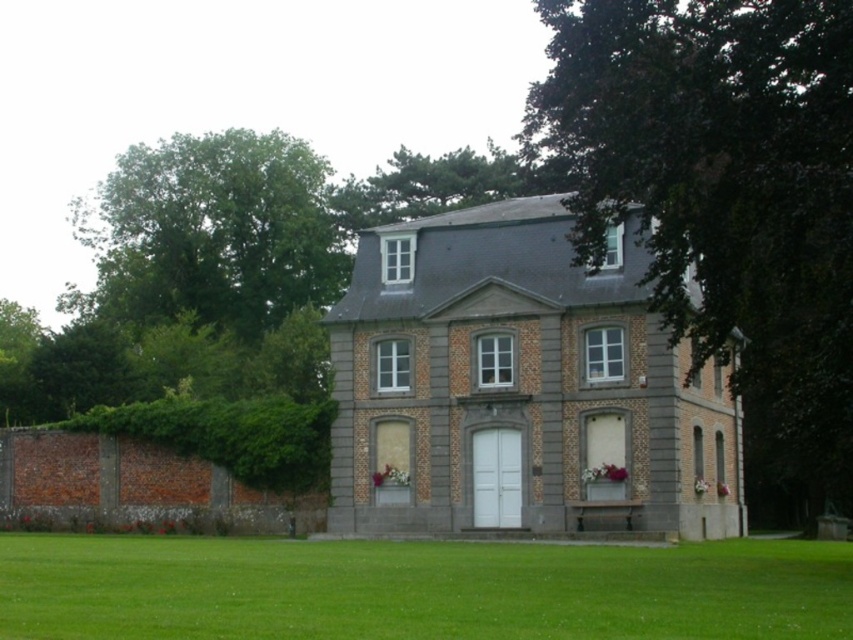
Question: Can you confirm if dark green leafy tree at right is positioned above green leafy tree at upper left?

Choices:
 (A) yes
 (B) no

Answer: (B)

Question: Which object is closer to the camera taking this photo?

Choices:
 (A) dark green leafy tree at right
 (B) green grass at lower center
 (C) green leafy hedge at left

Answer: (B)

Question: Does green leafy tree at upper left have a greater width compared to green leafy hedge at left?

Choices:
 (A) yes
 (B) no

Answer: (A)

Question: Among these points, which one is farthest from the camera?

Choices:
 (A) coord(595,13)
 (B) coord(711,605)

Answer: (A)

Question: Which object is farther from the camera taking this photo?

Choices:
 (A) green leafy hedge at left
 (B) dark green leafy tree at right

Answer: (A)

Question: Is green grass at lower center closer to the viewer compared to green leafy hedge at left?

Choices:
 (A) no
 (B) yes

Answer: (B)